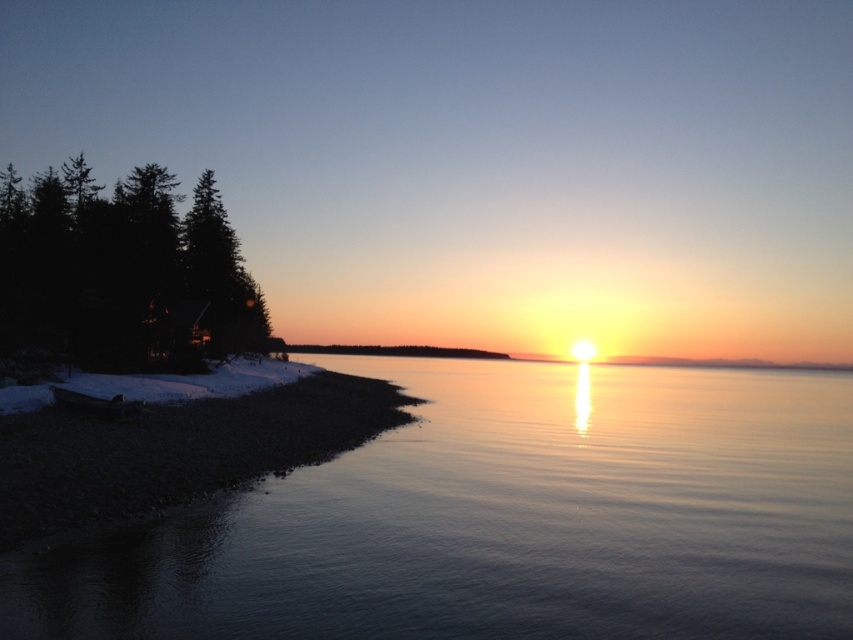
Question: Which object appears closest to the camera in this image?

Choices:
 (A) smooth gravel shoreline at lower left
 (B) smooth reflective water at center

Answer: (B)

Question: Is smooth reflective water at center thinner than dark green textured trees at left?

Choices:
 (A) no
 (B) yes

Answer: (B)

Question: Is smooth reflective water at center to the left of dark green textured trees at left from the viewer's perspective?

Choices:
 (A) yes
 (B) no

Answer: (B)

Question: Does smooth reflective water at center have a greater width compared to dark green textured trees at left?

Choices:
 (A) yes
 (B) no

Answer: (B)

Question: Which point appears farthest from the camera in this image?

Choices:
 (A) (225, 435)
 (B) (265, 321)

Answer: (B)

Question: Which point is closer to the camera?

Choices:
 (A) (7, 417)
 (B) (692, 428)
 (C) (206, 198)

Answer: (A)